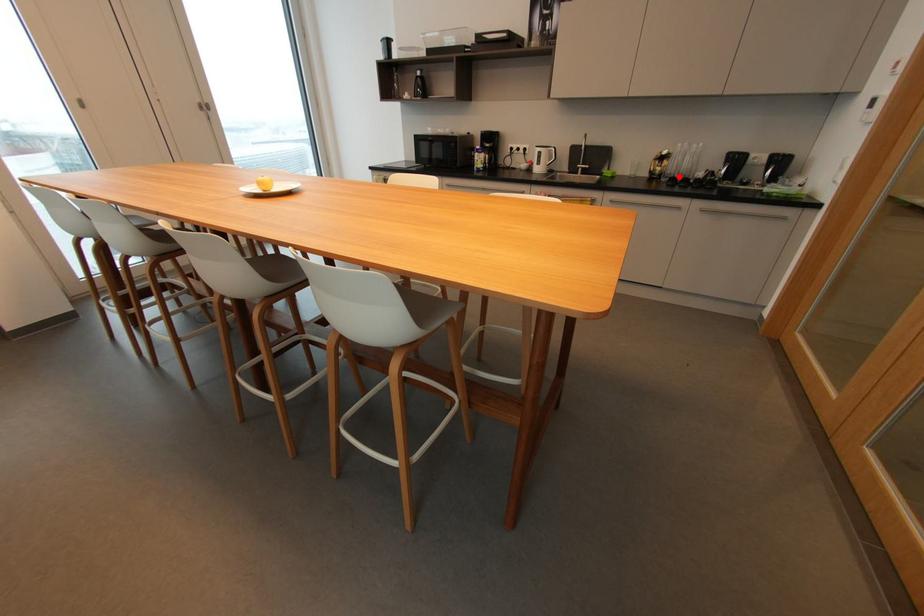
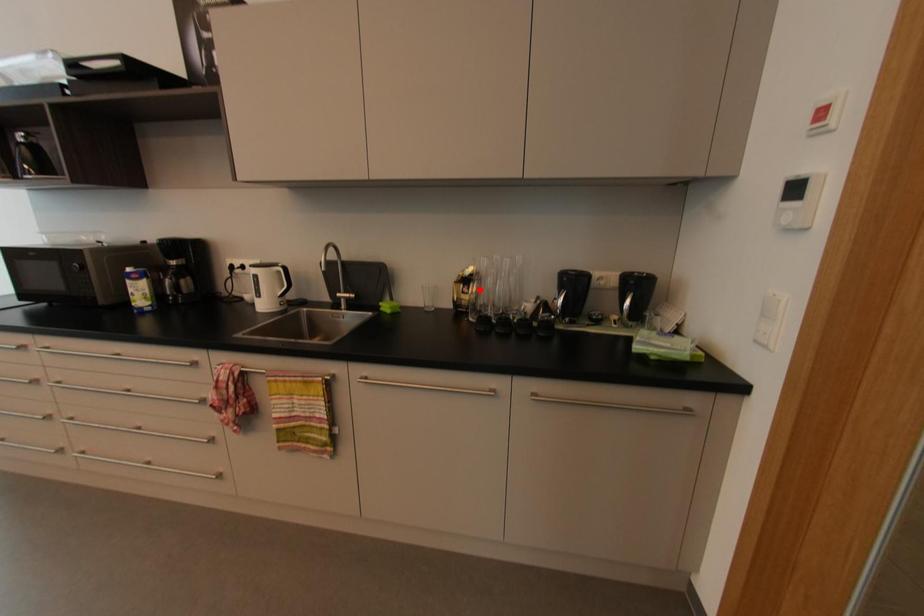
I am providing you with two images of the same scene from different viewpoints. A red point is marked on the first image and another point is marked on the second image. Does the point marked in image1 correspond to the same location as the one in image2?

No